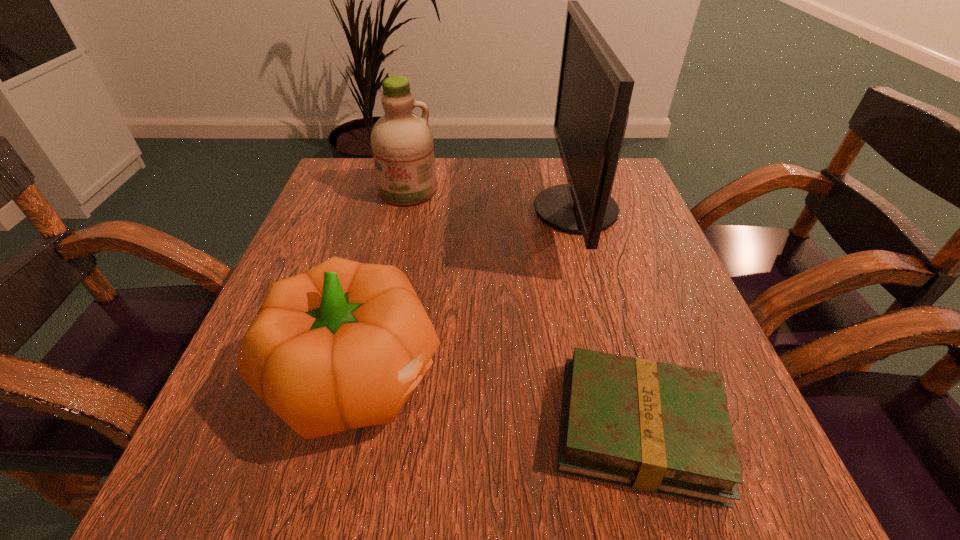
This screenshot has height=540, width=960. Identify the location of object present at the far right corner. (594, 92).

Image resolution: width=960 pixels, height=540 pixels. Identify the location of object present at the near right corner. (657, 427).

Locate an element on the screen. This screenshot has width=960, height=540. vacant space at the far edge of the desktop is located at coordinates (493, 174).

Where is `free space at the near edge`? This screenshot has height=540, width=960. free space at the near edge is located at coordinates (326, 518).

The width and height of the screenshot is (960, 540). I want to click on free space at the left edge of the desktop, so click(x=235, y=435).

Identify the location of free region at the right edge of the desktop. The height and width of the screenshot is (540, 960). (641, 212).

In the image, there is a desktop. Where is `vacant region at the near right corner`? This screenshot has width=960, height=540. vacant region at the near right corner is located at coordinates (779, 480).

I want to click on vacant area between the tallest object and the cleansing agent, so pyautogui.click(x=492, y=201).

Locate an element on the screen. empty space that is in between the pumpkin and the monitor is located at coordinates 468,293.

At what (x,y) coordinates should I click in order to perform the action: click on free space between the book and the cleansing agent. Please return your answer as a coordinate pair (x, y). The image size is (960, 540). Looking at the image, I should click on (523, 310).